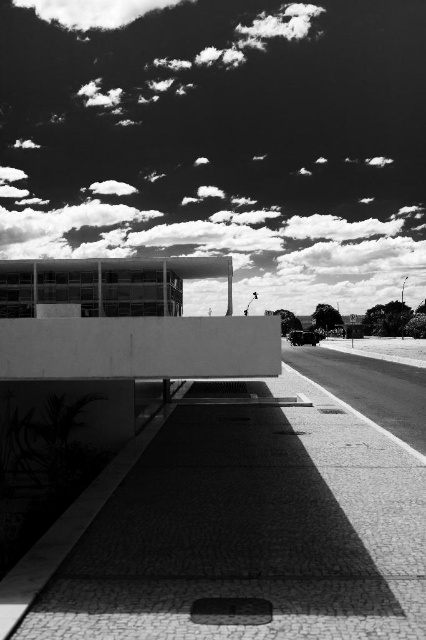
Can you confirm if cloudy sky at upper center is thinner than white fluffy cloud at upper center?

Incorrect, cloudy sky at upper center's width is not less than white fluffy cloud at upper center's.

Based on the photo, can you confirm if cloudy sky at upper center is taller than white fluffy cloud at upper center?

Correct, cloudy sky at upper center is much taller as white fluffy cloud at upper center.

Which is in front, point (351, 145) or point (80, 29)?

Point (80, 29) is in front.

Locate an element on the screen. The height and width of the screenshot is (640, 426). cloudy sky at upper center is located at coordinates (224, 141).